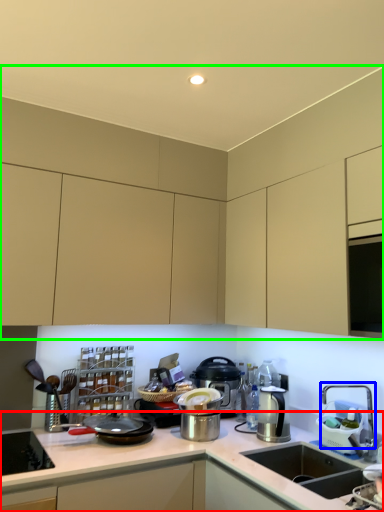
Question: Which object is the closest to the countertop (highlighted by a red box)? Choose among these: faucet (highlighted by a blue box) or cabinetry (highlighted by a green box).

Choices:
 (A) faucet
 (B) cabinetry

Answer: (A)